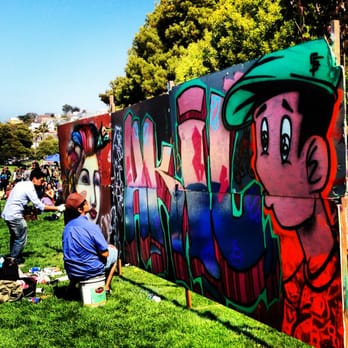
Image resolution: width=348 pixels, height=348 pixels. Find the location of `painting`. painting is located at coordinates (218, 213), (96, 180).